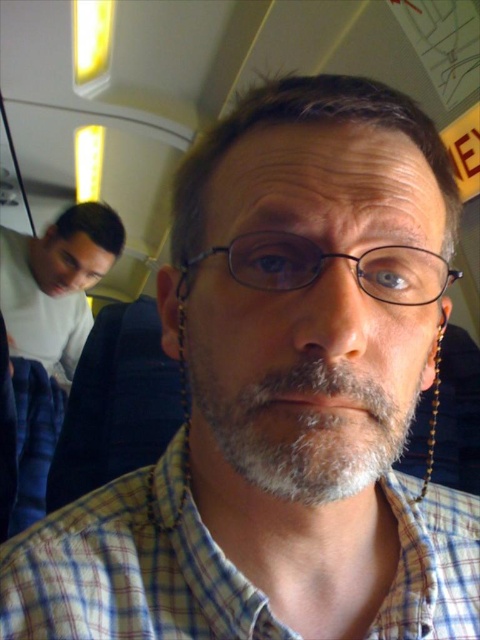
Does gray matte beard at center come behind light gray sweater at left?

No, gray matte beard at center is in front of light gray sweater at left.

Does point (261, 449) lie in front of point (12, 497)?

Yes, it is in front of point (12, 497).

Where is `gray matte beard at center`? gray matte beard at center is located at coordinates (300, 424).

The height and width of the screenshot is (640, 480). What do you see at coordinates (126, 577) in the screenshot?
I see `plaid cotton shirt at center` at bounding box center [126, 577].

The width and height of the screenshot is (480, 640). In order to click on plaid cotton shirt at center in this screenshot , I will do `click(126, 577)`.

Is point (99, 513) more distant than point (59, 292)?

No, it is in front of (59, 292).

This screenshot has width=480, height=640. I want to click on plaid cotton shirt at center, so click(126, 577).

What do you see at coordinates (126, 577) in the screenshot? I see `plaid cotton shirt at center` at bounding box center [126, 577].

Does plaid cotton shirt at center have a lesser width compared to gray matte beard at center?

Incorrect, plaid cotton shirt at center's width is not less than gray matte beard at center's.

Where is `plaid cotton shirt at center`? Image resolution: width=480 pixels, height=640 pixels. plaid cotton shirt at center is located at coordinates (126, 577).